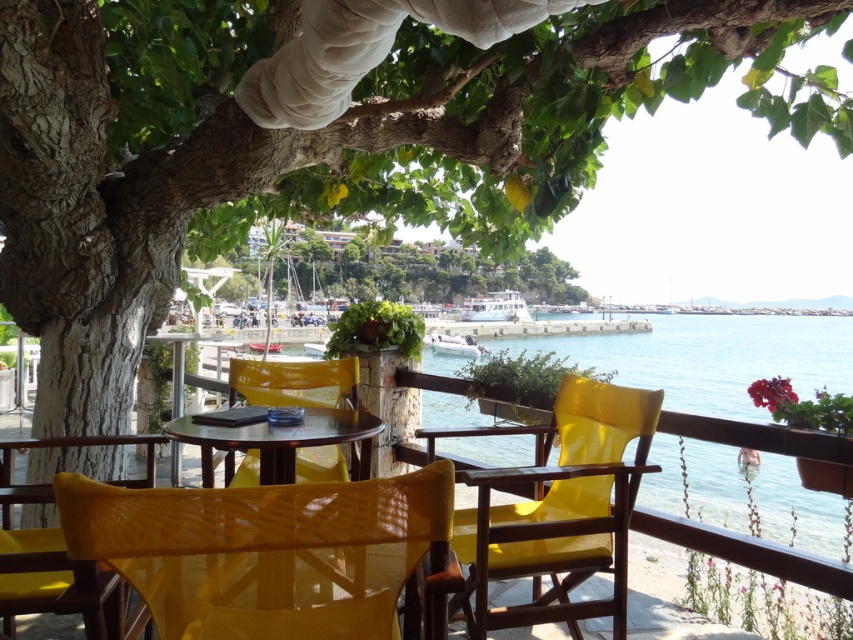
Is green leafy tree at center above glossy wood table at center?

Correct, green leafy tree at center is located above glossy wood table at center.

Which is behind, point (462, 253) or point (368, 472)?

Positioned behind is point (462, 253).

Which is behind, point (384, 269) or point (312, 442)?

The point (384, 269) is behind.

At what (x,y) coordinates should I click in order to perform the action: click on green leafy tree at center. Please return your answer as a coordinate pair (x, y). This screenshot has height=640, width=853. Looking at the image, I should click on (434, 272).

Does yellow woven chair at lower left appear on the right side of yellow fabric chair at center?

Incorrect, yellow woven chair at lower left is not on the right side of yellow fabric chair at center.

Between yellow woven chair at lower left and yellow fabric chair at center, which one has more height?

With more height is yellow fabric chair at center.

You are a GUI agent. You are given a task and a screenshot of the screen. Output one action in this format:
    pyautogui.click(x=<x>, y=<y>)
    Task: Click on the yellow woven chair at lower left
    
    Given the screenshot: What is the action you would take?
    pyautogui.click(x=263, y=552)

Where is `yellow woven chair at lower left`? yellow woven chair at lower left is located at coordinates (x=263, y=552).

Who is shorter, green leafy tree at center or matte yellow chair at lower left?

matte yellow chair at lower left

Can you confirm if green leafy tree at center is bigger than matte yellow chair at lower left?

Correct, green leafy tree at center is larger in size than matte yellow chair at lower left.

Between point (547, 268) and point (15, 548), which one is positioned in front?

Positioned in front is point (15, 548).

Where is `green leafy tree at center`? The height and width of the screenshot is (640, 853). green leafy tree at center is located at coordinates (434, 272).